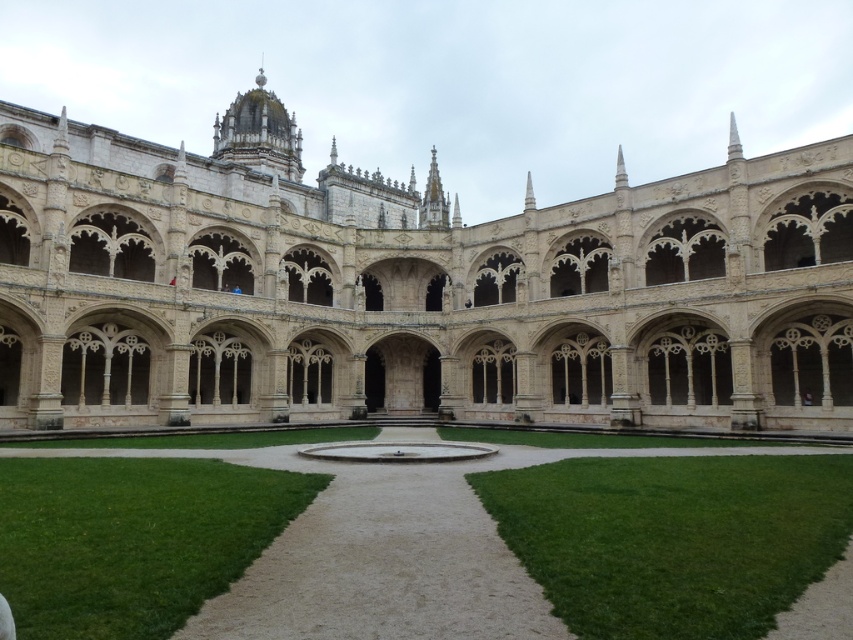
What do you see at coordinates (410, 288) in the screenshot?
I see `white stone monastery at center` at bounding box center [410, 288].

Which is behind, point (817, 177) or point (254, 636)?

Positioned behind is point (817, 177).

Who is more distant from viewer, (x=236, y=179) or (x=476, y=531)?

The point (x=236, y=179) is more distant.

This screenshot has width=853, height=640. In order to click on white stone monastery at center in this screenshot , I will do `click(410, 288)`.